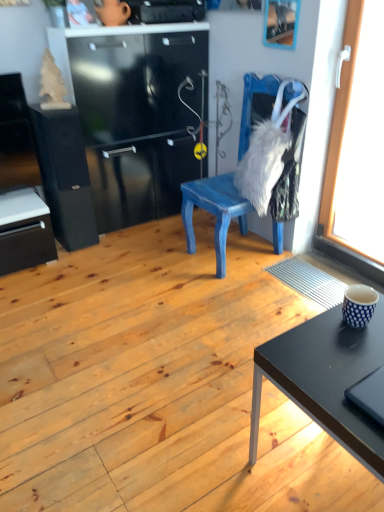
Question: Should I look upward or downward to see black matte file cabinet at left?

Choices:
 (A) down
 (B) up

Answer: (B)

Question: Is black matte file cabinet at left surrounding wooden picture frame at upper center?

Choices:
 (A) yes
 (B) no

Answer: (B)

Question: Does black matte file cabinet at left have a greater height compared to wooden picture frame at upper center?

Choices:
 (A) yes
 (B) no

Answer: (A)

Question: Considering the relative sizes of black matte file cabinet at left and wooden picture frame at upper center in the image provided, is black matte file cabinet at left wider than wooden picture frame at upper center?

Choices:
 (A) no
 (B) yes

Answer: (B)

Question: Can you see black matte file cabinet at left touching wooden picture frame at upper center?

Choices:
 (A) yes
 (B) no

Answer: (B)

Question: Is black matte file cabinet at left positioned beyond the bounds of wooden picture frame at upper center?

Choices:
 (A) no
 (B) yes

Answer: (B)

Question: From a real-world perspective, is black matte file cabinet at left positioned under wooden picture frame at upper center based on gravity?

Choices:
 (A) no
 (B) yes

Answer: (B)

Question: Is blue dotted cup at right closer to camera compared to blue painted wood chair at center?

Choices:
 (A) no
 (B) yes

Answer: (B)

Question: Is blue dotted cup at right surrounding blue painted wood chair at center?

Choices:
 (A) yes
 (B) no

Answer: (B)

Question: Can you confirm if blue dotted cup at right is positioned to the right of blue painted wood chair at center?

Choices:
 (A) no
 (B) yes

Answer: (B)

Question: Is blue dotted cup at right next to blue painted wood chair at center?

Choices:
 (A) yes
 (B) no

Answer: (B)

Question: Does blue dotted cup at right have a larger size compared to blue painted wood chair at center?

Choices:
 (A) yes
 (B) no

Answer: (B)

Question: Can we say blue dotted cup at right lies outside blue painted wood chair at center?

Choices:
 (A) yes
 (B) no

Answer: (A)

Question: Is transparent glass window at right at the left side of black matte file cabinet at left?

Choices:
 (A) no
 (B) yes

Answer: (A)